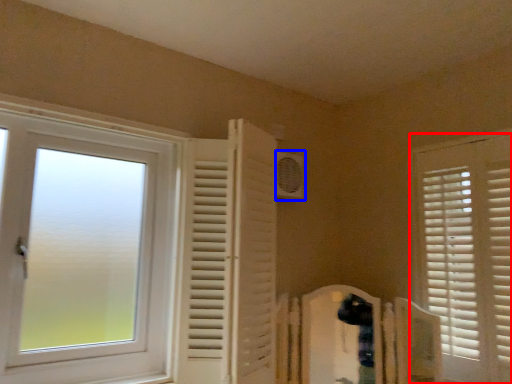
Question: Which object appears closest to the camera in this image, window (highlighted by a red box) or air conditioning (highlighted by a blue box)?

Choices:
 (A) window
 (B) air conditioning

Answer: (A)